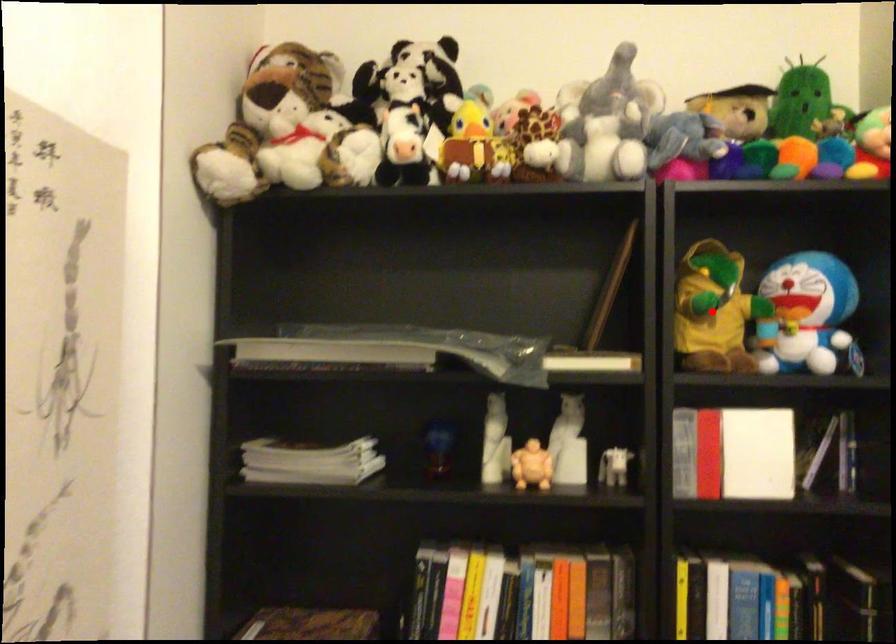
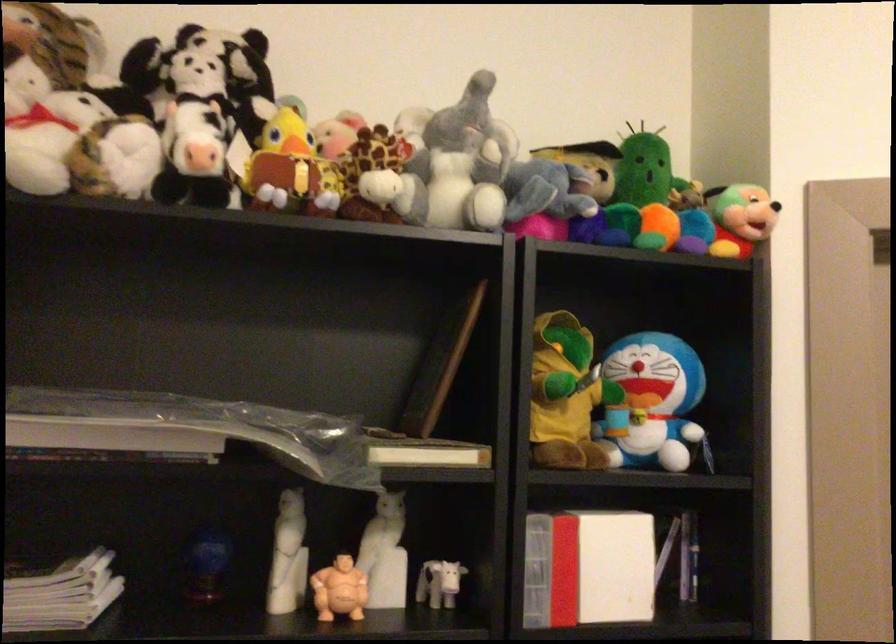
Question: A red point is marked in image1. In image2, is the corresponding 3D point closer to the camera or farther? Reply with the corresponding letter.

Choices:
 (A) The corresponding 3D point is closer.
 (B) The corresponding 3D point is farther.

Answer: (A)